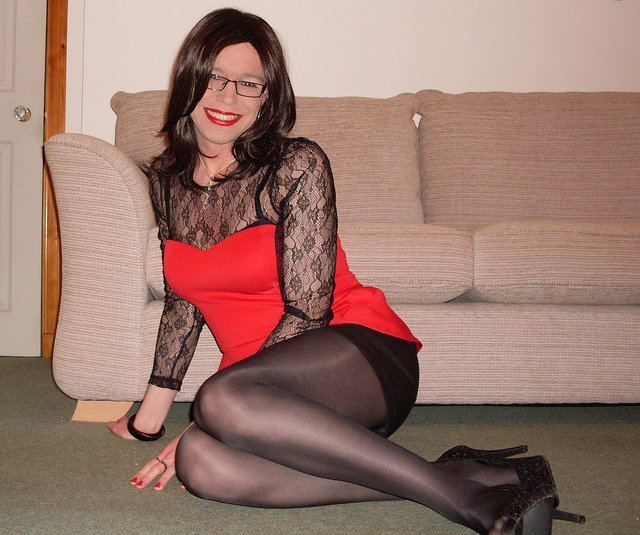
You are a GUI agent. You are given a task and a screenshot of the screen. Output one action in this format:
    pyautogui.click(x=<x>, y=<y>)
    Task: Click on the door
    The width and height of the screenshot is (640, 535).
    Given the screenshot: What is the action you would take?
    (x=13, y=51)